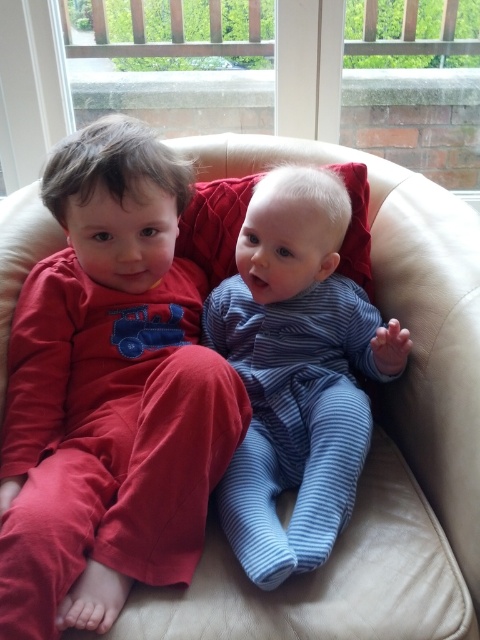
Is matte red pajamas at left above blue striped onesie at center?

Yes.

Between matte red pajamas at left and blue striped onesie at center, which one is positioned lower?

Positioned lower is blue striped onesie at center.

Which is in front, point (58, 150) or point (307, 321)?

Point (58, 150) is in front.

Where is `matte red pajamas at left`? matte red pajamas at left is located at coordinates (108, 394).